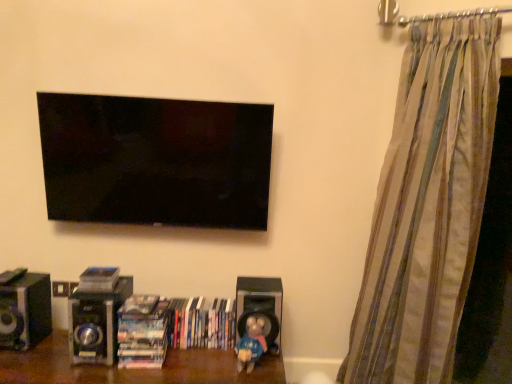
The height and width of the screenshot is (384, 512). In order to click on free space between blue matte toy at lower center and hardcover books at center, the 2th book when ordered from right to left in this screenshot , I will do `click(197, 355)`.